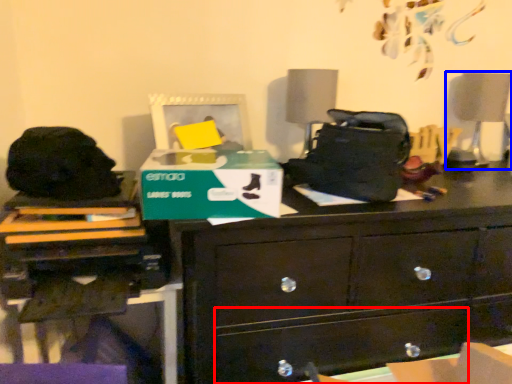
Question: Among these objects, which one is nearest to the camera, drawer (highlighted by a red box) or swivel chair (highlighted by a blue box)?

Choices:
 (A) drawer
 (B) swivel chair

Answer: (A)